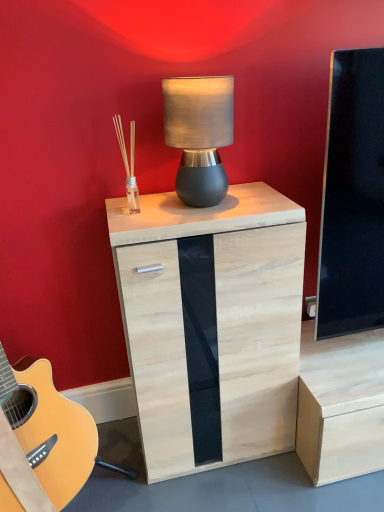
What do you see at coordinates (211, 324) in the screenshot?
I see `light wood/glass cabinet at center` at bounding box center [211, 324].

Image resolution: width=384 pixels, height=512 pixels. What are the coordinates of `light wood/glass cabinet at center` in the screenshot? It's located at (211, 324).

What do you see at coordinates (199, 135) in the screenshot?
I see `matte gray lamp at center` at bounding box center [199, 135].

Identify the location of matte gray lamp at center. (199, 135).

At what (x,y) coordinates should I click in order to perform the action: click on light wood/glass cabinet at center. Please return your answer as a coordinate pair (x, y). Image resolution: width=384 pixels, height=512 pixels. Looking at the image, I should click on (211, 324).

Based on the photo, between light wood/glass cabinet at center and matte gray lamp at center, which one appears on the right side from the viewer's perspective?

Positioned to the right is light wood/glass cabinet at center.

Who is more distant, light wood/glass cabinet at center or matte gray lamp at center?

light wood/glass cabinet at center is further from the camera.

Is point (207, 296) behind point (213, 151)?

Yes, point (207, 296) is behind point (213, 151).

From the image's perspective, which is below, light wood/glass cabinet at center or matte gray lamp at center?

light wood/glass cabinet at center.

From a real-world perspective, between light wood/glass cabinet at center and matte gray lamp at center, who is vertically lower?

light wood/glass cabinet at center, from a real-world perspective.

Can you confirm if light wood/glass cabinet at center is thinner than matte gray lamp at center?

In fact, light wood/glass cabinet at center might be wider than matte gray lamp at center.

Considering the sizes of objects light wood/glass cabinet at center and matte gray lamp at center in the image provided, who is shorter, light wood/glass cabinet at center or matte gray lamp at center?

Standing shorter between the two is matte gray lamp at center.

Considering the sizes of objects light wood/glass cabinet at center and matte gray lamp at center in the image provided, who is bigger, light wood/glass cabinet at center or matte gray lamp at center?

light wood/glass cabinet at center.

Is matte gray lamp at center surrounded by light wood/glass cabinet at center?

That's incorrect, matte gray lamp at center is not inside light wood/glass cabinet at center.

Is light wood/glass cabinet at center next to matte gray lamp at center and touching it?

No.

In the scene shown: Is light wood/glass cabinet at center looking in the opposite direction of matte gray lamp at center?

No.

How many degrees apart are the facing directions of light wood/glass cabinet at center and matte gray lamp at center?

There is a 2.67-degree angle between the facing directions of light wood/glass cabinet at center and matte gray lamp at center.

The width and height of the screenshot is (384, 512). I want to click on chest of drawers to the right of matte gray lamp at center, so click(211, 324).

Can you confirm if matte gray lamp at center is positioned to the left of light wood/glass cabinet at center?

Indeed, matte gray lamp at center is positioned on the left side of light wood/glass cabinet at center.

Is matte gray lamp at center in front of or behind light wood/glass cabinet at center in the image?

Visually, matte gray lamp at center is located in front of light wood/glass cabinet at center.

Does point (213, 91) come farther from viewer compared to point (208, 294)?

No, it is in front of (208, 294).

From the image's perspective, between matte gray lamp at center and light wood/glass cabinet at center, who is located below?

light wood/glass cabinet at center appears lower in the image.

From a real-world perspective, who is located lower, matte gray lamp at center or light wood/glass cabinet at center?

From a 3D spatial view, light wood/glass cabinet at center is below.

Which of these two, matte gray lamp at center or light wood/glass cabinet at center, is wider?

With larger width is light wood/glass cabinet at center.

Can you confirm if matte gray lamp at center is shorter than light wood/glass cabinet at center?

Yes, matte gray lamp at center is shorter than light wood/glass cabinet at center.

Consider the image. Considering the relative sizes of matte gray lamp at center and light wood/glass cabinet at center in the image provided, is matte gray lamp at center smaller than light wood/glass cabinet at center?

Yes.

Could light wood/glass cabinet at center be considered to be inside matte gray lamp at center?

Definitely not — light wood/glass cabinet at center is not inside matte gray lamp at center.

Are matte gray lamp at center and light wood/glass cabinet at center located far from each other?

Actually, matte gray lamp at center and light wood/glass cabinet at center are a little close together.

From the picture: Is matte gray lamp at center facing away from light wood/glass cabinet at center?

matte gray lamp at center is not turned away from light wood/glass cabinet at center.

What's the angular difference between matte gray lamp at center and light wood/glass cabinet at center's facing directions?

2.67 degrees separate the facing orientations of matte gray lamp at center and light wood/glass cabinet at center.

Identify the location of chest of drawers on the right of the matte gray lamp at center. (211, 324).

The image size is (384, 512). In order to click on lamp lying in front of the light wood/glass cabinet at center in this screenshot , I will do `click(199, 135)`.

At what (x,y) coordinates should I click in order to perform the action: click on lamp above the light wood/glass cabinet at center (from the image's perspective). Please return your answer as a coordinate pair (x, y). Image resolution: width=384 pixels, height=512 pixels. Looking at the image, I should click on (199, 135).